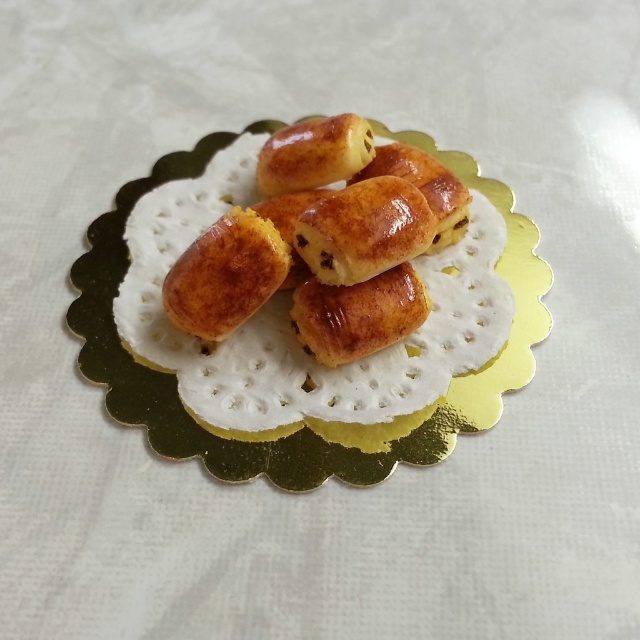
Who is positioned more to the left, golden glazed pastry at center or golden paper doily at center?

From the viewer's perspective, golden glazed pastry at center appears more on the left side.

What are the coordinates of `golden glazed pastry at center` in the screenshot? It's located at (323, 243).